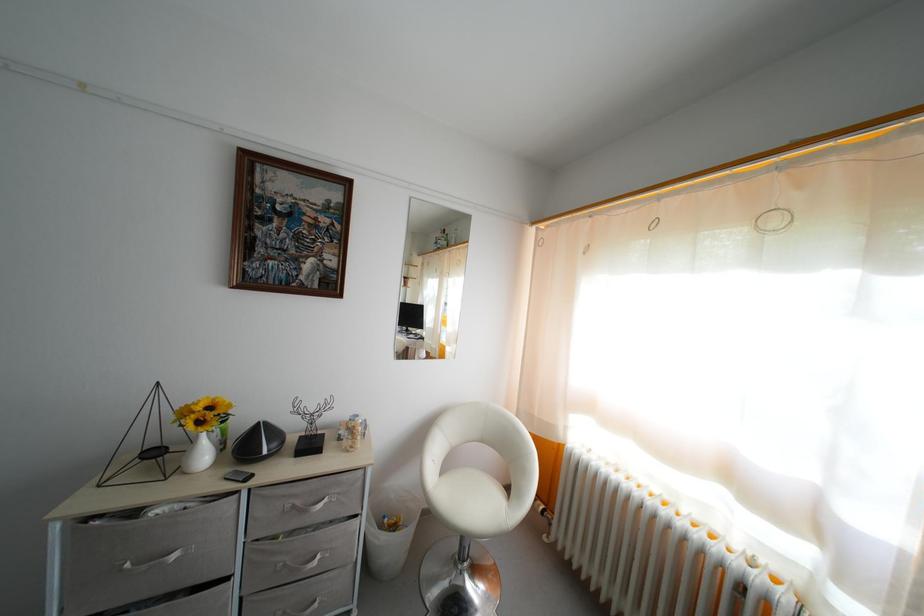
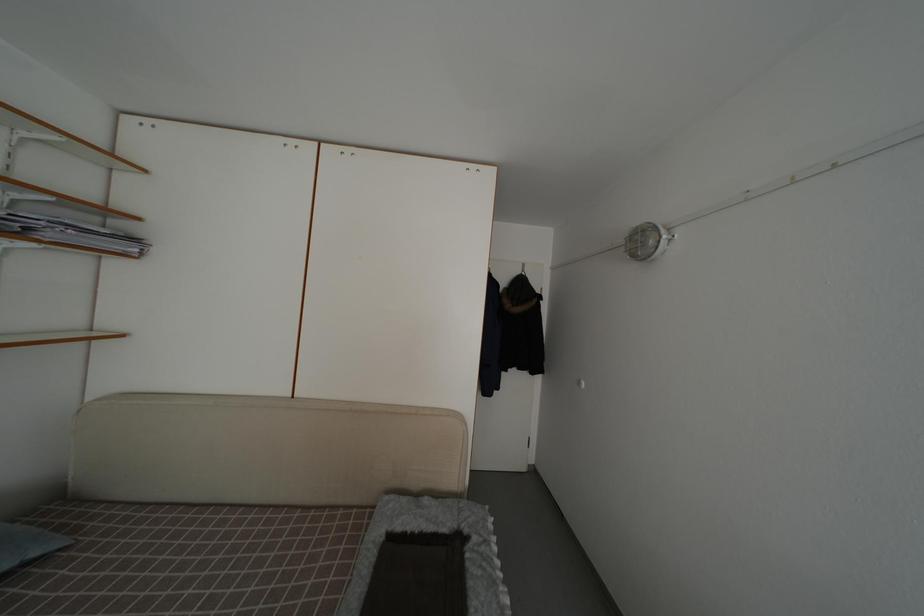
Question: The images are taken continuously from a first-person perspective. In which direction is your viewpoint rotating?

Choices:
 (A) Left
 (B) Right
 (C) Up
 (D) Down

Answer: (A)